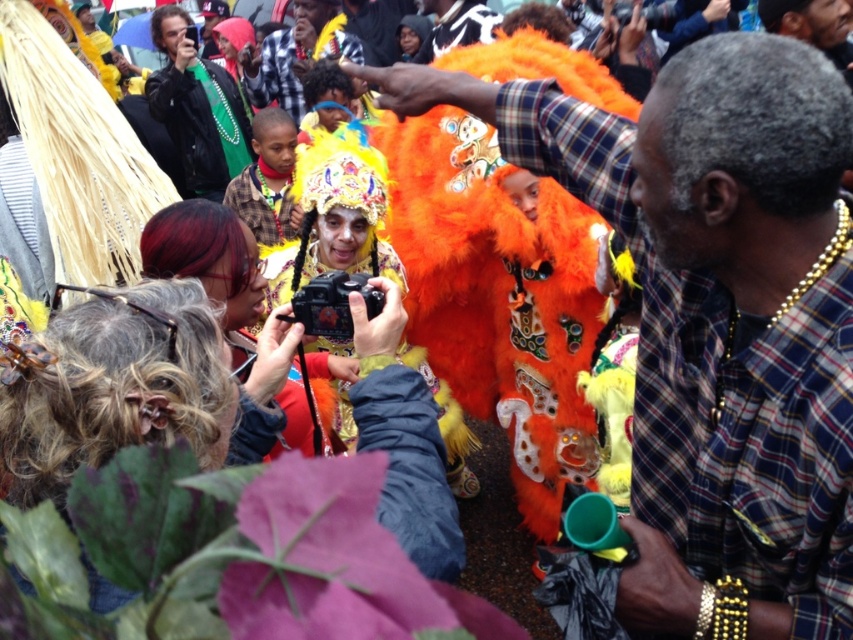
Can you confirm if green fabric jacket at upper left is smaller than orange fuzzy costume at center?

Yes.

Is point (194, 58) closer to camera compared to point (314, 51)?

Yes, point (194, 58) is closer to viewer.

I want to click on green fabric jacket at upper left, so click(x=196, y=108).

Does plaid shirt at center have a larger size compared to green fabric jacket at upper left?

Actually, plaid shirt at center might be smaller than green fabric jacket at upper left.

Who is more distant from viewer, (670, 76) or (177, 92)?

The point (177, 92) is behind.

The height and width of the screenshot is (640, 853). Identify the location of plaid shirt at center. (715, 316).

Is plaid shirt at center behind orange fuzzy costume at center?

No.

Can you confirm if plaid shirt at center is wider than orange fuzzy costume at center?

No.

Looking at this image, who is more distant from viewer, (843, 397) or (335, 29)?

The point (335, 29) is more distant.

This screenshot has width=853, height=640. What are the coordinates of `plaid shirt at center` in the screenshot? It's located at (715, 316).